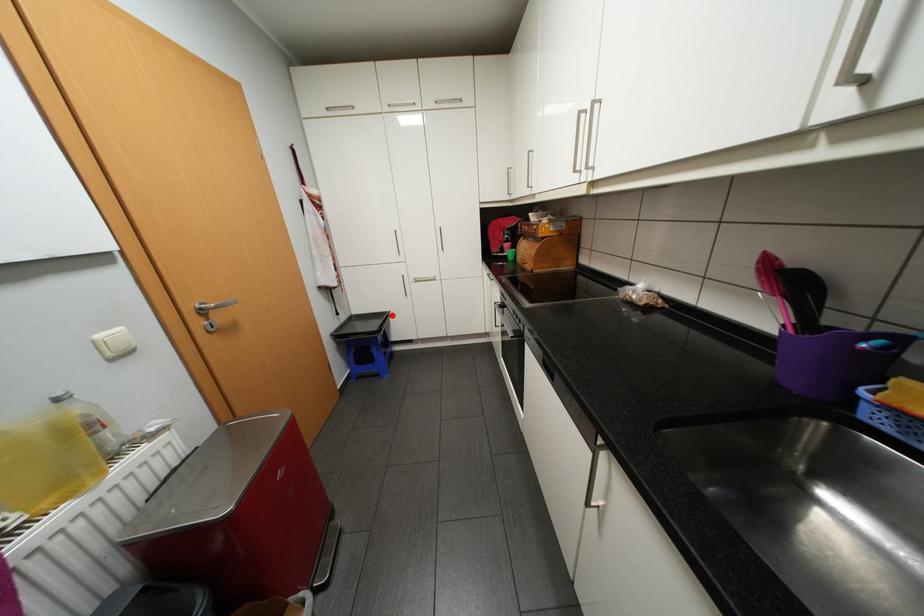
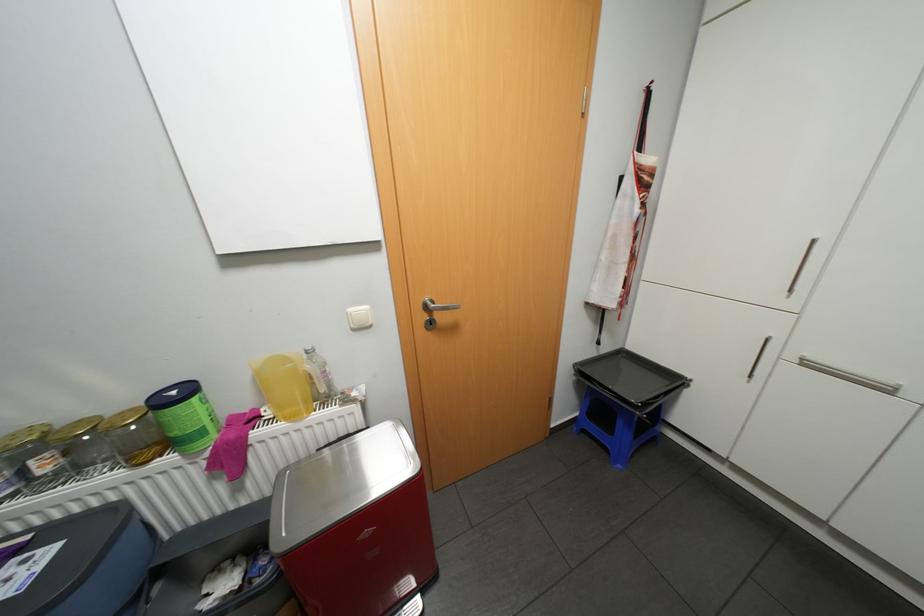
Question: A red point is marked in image1. In image2, is the corresponding 3D point closer to the camera or farther? Reply with the corresponding letter.

Choices:
 (A) The corresponding 3D point is closer.
 (B) The corresponding 3D point is farther.

Answer: (B)